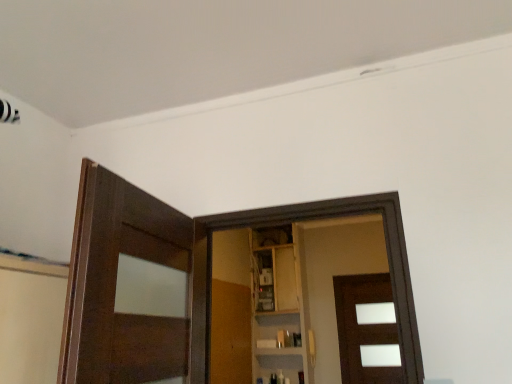
Question: Is brown matte door at center positioned far away from wooden at center?

Choices:
 (A) yes
 (B) no

Answer: (A)

Question: Can you confirm if brown matte door at center is taller than wooden at center?

Choices:
 (A) yes
 (B) no

Answer: (B)

Question: Does brown matte door at center lie in front of wooden at center?

Choices:
 (A) no
 (B) yes

Answer: (A)

Question: From the image's perspective, is brown matte door at center on wooden at center?

Choices:
 (A) yes
 (B) no

Answer: (B)

Question: Is brown matte door at center wider than wooden at center?

Choices:
 (A) no
 (B) yes

Answer: (B)

Question: Considering the positions of wooden at center and brown matte door at center in the image, is wooden at center wider or thinner than brown matte door at center?

Choices:
 (A) thin
 (B) wide

Answer: (A)

Question: Choose the correct answer: Is wooden at center inside brown matte door at center or outside it?

Choices:
 (A) outside
 (B) inside

Answer: (A)

Question: From their relative heights in the image, would you say wooden at center is taller or shorter than brown matte door at center?

Choices:
 (A) short
 (B) tall

Answer: (B)

Question: In the image, is wooden at center positioned in front of or behind brown matte door at center?

Choices:
 (A) front
 (B) behind

Answer: (A)

Question: In terms of width, does wooden cabinet at center look wider or thinner when compared to wooden at center?

Choices:
 (A) thin
 (B) wide

Answer: (B)

Question: Is wooden cabinet at center inside or outside of wooden at center?

Choices:
 (A) outside
 (B) inside

Answer: (A)

Question: Based on their positions, is wooden cabinet at center located to the left or right of wooden at center?

Choices:
 (A) right
 (B) left

Answer: (A)

Question: Considering the positions of wooden cabinet at center and wooden at center in the image, is wooden cabinet at center bigger or smaller than wooden at center?

Choices:
 (A) big
 (B) small

Answer: (A)

Question: Is wooden at center spatially inside wooden cabinet at center, or outside of it?

Choices:
 (A) outside
 (B) inside

Answer: (A)

Question: From their relative heights in the image, would you say wooden at center is taller or shorter than wooden cabinet at center?

Choices:
 (A) short
 (B) tall

Answer: (A)